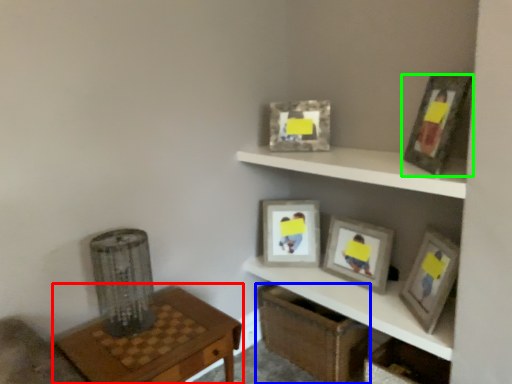
Question: Which is nearer to the table (highlighted by a red box)? crate (highlighted by a blue box) or picture frame (highlighted by a green box).

Choices:
 (A) crate
 (B) picture frame

Answer: (A)